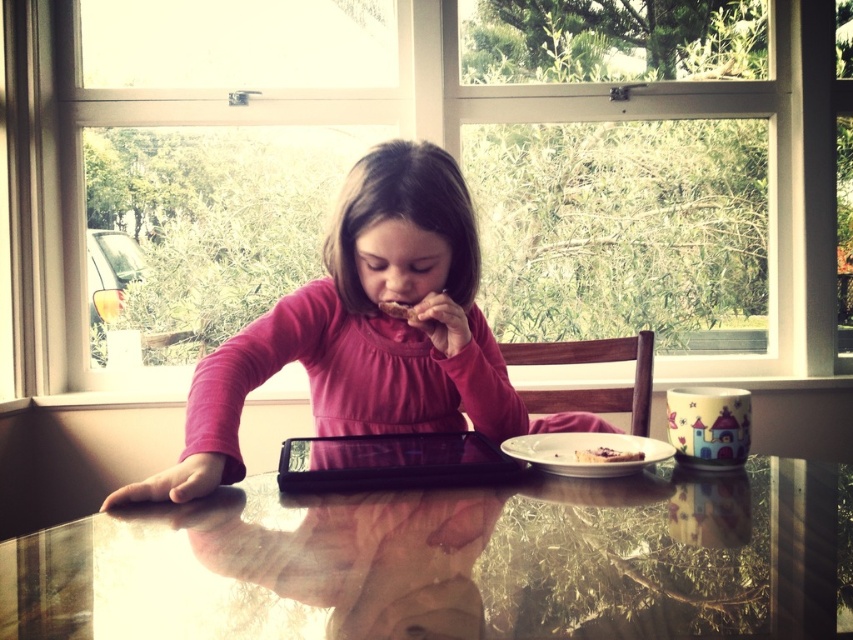
Question: Among these points, which one is nearest to the camera?

Choices:
 (A) (601, 449)
 (B) (192, 412)
 (C) (107, 518)
 (D) (582, 472)

Answer: (C)

Question: Estimate the real-world distances between objects in this image. Which object is closer to the pink matte shirt at center?

Choices:
 (A) brown crumbly snack at center
 (B) smooth chocolate cake at center
 (C) white glossy plate at center
 (D) glossy glass table at center

Answer: (A)

Question: Does glossy glass table at center appear under pink matte shirt at center?

Choices:
 (A) yes
 (B) no

Answer: (A)

Question: Can you confirm if pink matte shirt at center is positioned to the left of white glossy plate at center?

Choices:
 (A) no
 (B) yes

Answer: (B)

Question: Which point is closer to the camera taking this photo?

Choices:
 (A) (643, 452)
 (B) (515, 500)
 (C) (514, 460)
 (D) (582, 458)

Answer: (B)

Question: Is pink matte shirt at center smaller than black glossy tablet at center?

Choices:
 (A) no
 (B) yes

Answer: (A)